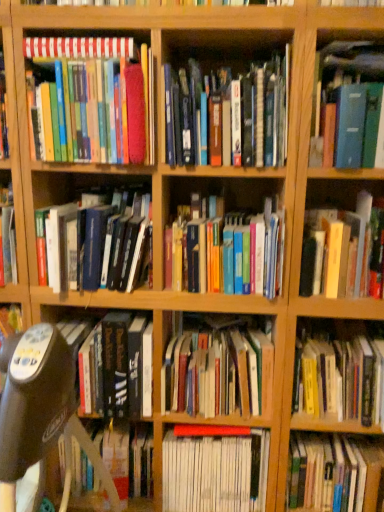
Question: Is yellow hardcover book at lower right, the ninth book from the top, further to the viewer compared to hardcover book at center, which is the eleventh book in top-to-bottom order?

Choices:
 (A) yes
 (B) no

Answer: (B)

Question: Is hardcover book at center, which is the eleventh book in top-to-bottom order, surrounded by yellow hardcover book at lower right, the 4th book positioned from the bottom?

Choices:
 (A) yes
 (B) no

Answer: (B)

Question: Can you confirm if yellow hardcover book at lower right, the 4th book positioned from the bottom, is thinner than hardcover book at center, which is the eleventh book in top-to-bottom order?

Choices:
 (A) yes
 (B) no

Answer: (B)

Question: Can you confirm if yellow hardcover book at lower right, the ninth book from the top, is positioned to the right of hardcover book at center, which is the eleventh book in top-to-bottom order?

Choices:
 (A) no
 (B) yes

Answer: (B)

Question: Is yellow hardcover book at lower right, the 4th book positioned from the bottom, positioned beyond the bounds of hardcover book at center, marked as the second book in a bottom-to-top arrangement?

Choices:
 (A) yes
 (B) no

Answer: (A)

Question: In the image, is hardcover books at center, which is counted as the 5th book, starting from the top, positioned in front of or behind blue hardcover book at upper right, placed as the tenth book when sorted from bottom to top?

Choices:
 (A) front
 (B) behind

Answer: (B)

Question: Considering the positions of point (178, 276) and point (367, 78), is point (178, 276) closer or farther from the camera than point (367, 78)?

Choices:
 (A) farther
 (B) closer

Answer: (A)

Question: From the image's perspective, is hardcover books at center, the eighth book from the bottom, positioned above or below blue hardcover book at upper right, placed as the tenth book when sorted from bottom to top?

Choices:
 (A) below
 (B) above

Answer: (A)

Question: From a real-world perspective, relative to blue hardcover book at upper right, which is the 3th book in top-to-bottom order, is hardcover books at center, the eighth book from the bottom, vertically above or below?

Choices:
 (A) above
 (B) below

Answer: (B)

Question: Is hardcover book at center, the sixth book ordered from the bottom, situated inside black plastic swivel chair at center-left or outside?

Choices:
 (A) inside
 (B) outside

Answer: (B)

Question: From their relative heights in the image, would you say hardcover book at center, the sixth book ordered from the bottom, is taller or shorter than black plastic swivel chair at center-left?

Choices:
 (A) short
 (B) tall

Answer: (A)

Question: In the image, is hardcover book at center, the sixth book ordered from the bottom, positioned in front of or behind black plastic swivel chair at center-left?

Choices:
 (A) behind
 (B) front

Answer: (A)

Question: In terms of width, does hardcover book at center, the sixth book ordered from the bottom, look wider or thinner when compared to black plastic swivel chair at center-left?

Choices:
 (A) wide
 (B) thin

Answer: (B)

Question: Based on their sizes in the image, would you say hardcover books at center, the eighth book from the bottom, is bigger or smaller than hardcover book at left, positioned as the 9th book in bottom-to-top order?

Choices:
 (A) big
 (B) small

Answer: (B)

Question: Considering their positions, is hardcover books at center, which is counted as the 5th book, starting from the top, located in front of or behind hardcover book at left, the fourth book when ordered from top to bottom?

Choices:
 (A) front
 (B) behind

Answer: (A)